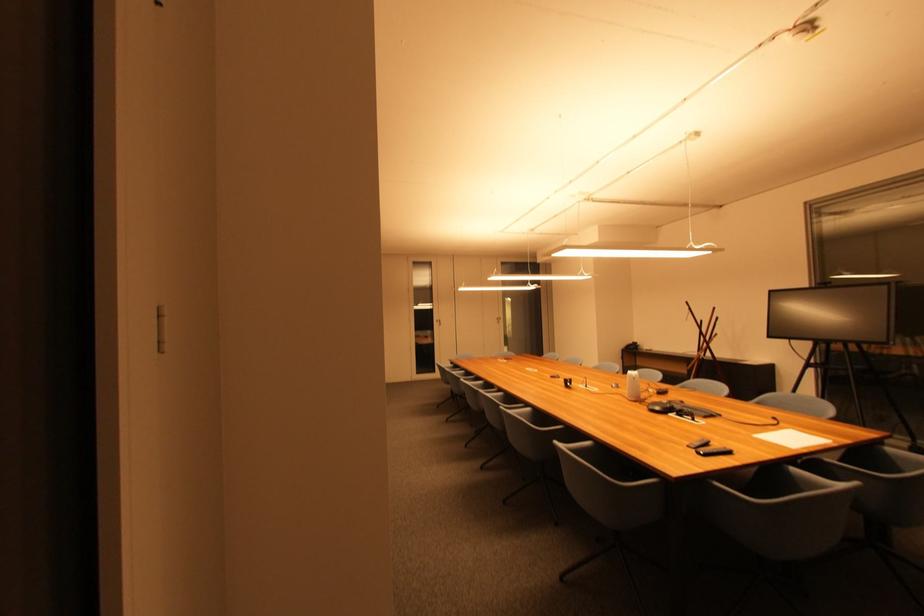
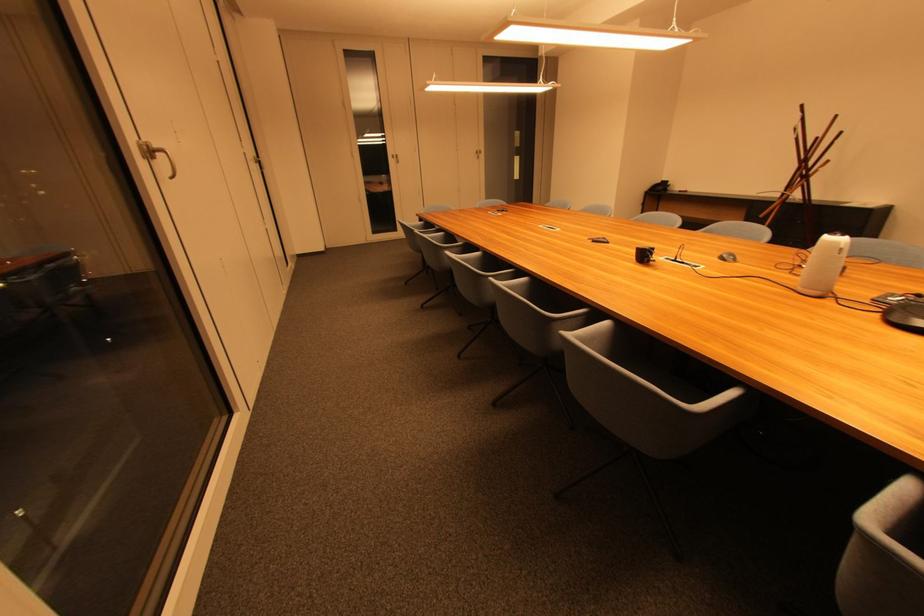
In the second image, find the point that corresponds to point (574, 386) in the first image.

(649, 257)